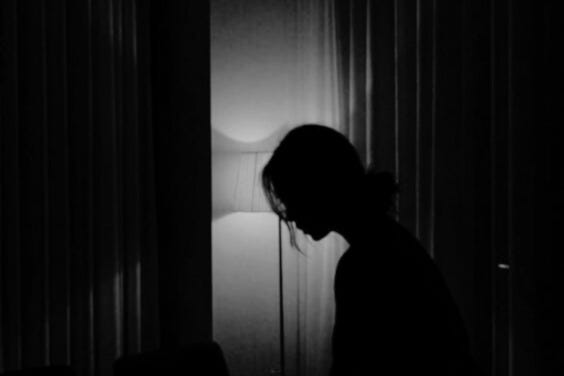
Find the location of `lamp`. lamp is located at coordinates (257, 192).